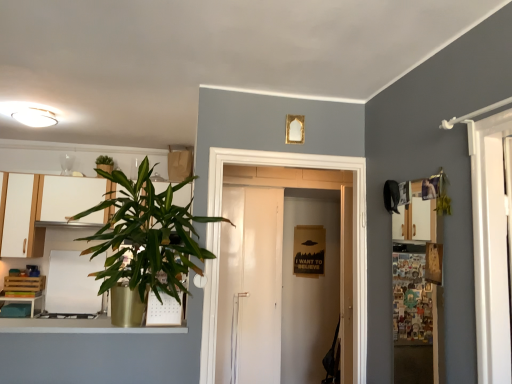
Identify the location of vacant area on top of white matte dry erase board at left (from a real-world perspective). [67, 248].